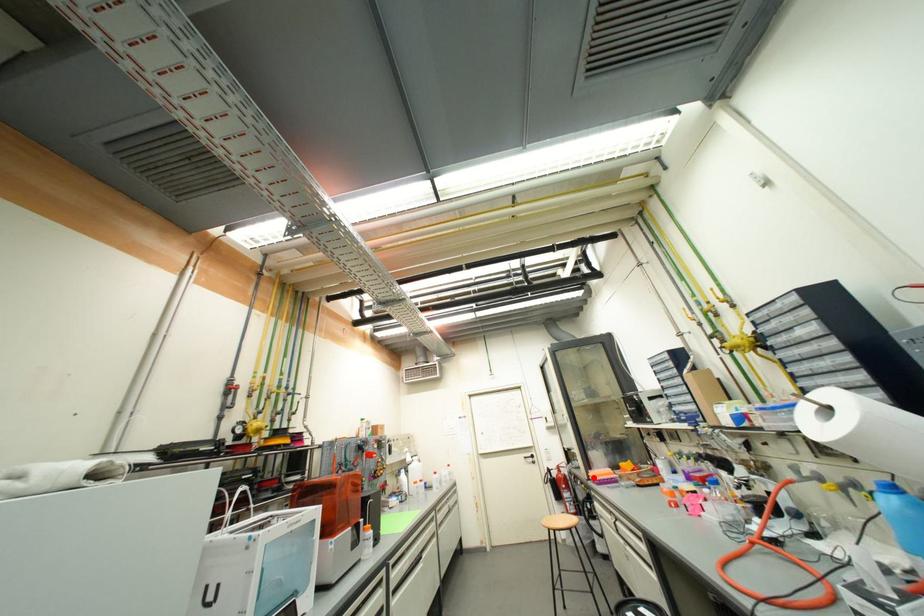
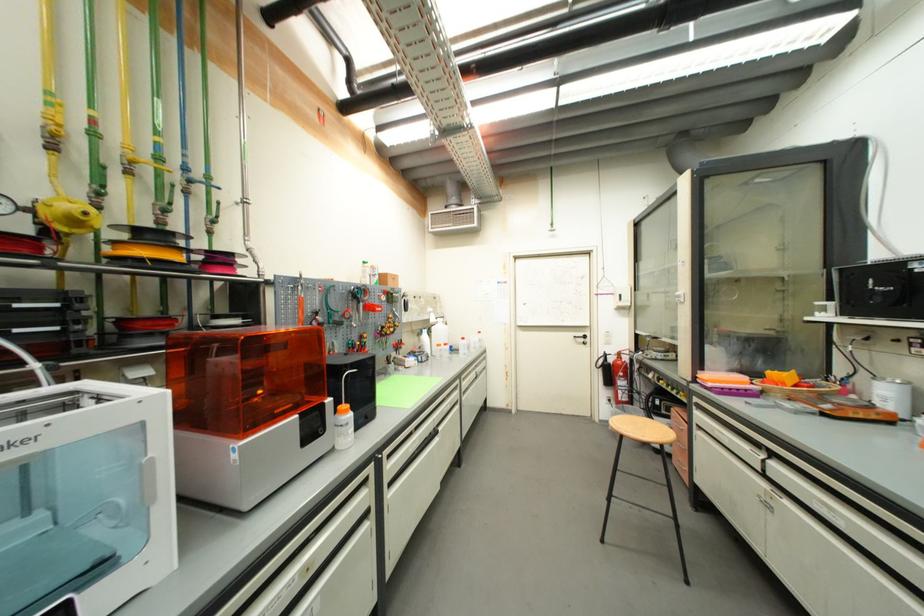
Question: A red point is marked in image1. In image2, is the corresponding 3D point closer to the camera or farther? Reply with the corresponding letter.

Choices:
 (A) The corresponding 3D point is closer.
 (B) The corresponding 3D point is farther.

Answer: (A)